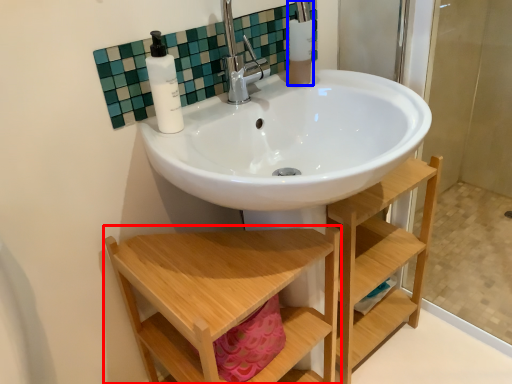
Question: Which point is further to the camera, furniture (highlighted by a red box) or toiletry (highlighted by a blue box)?

Choices:
 (A) furniture
 (B) toiletry

Answer: (B)